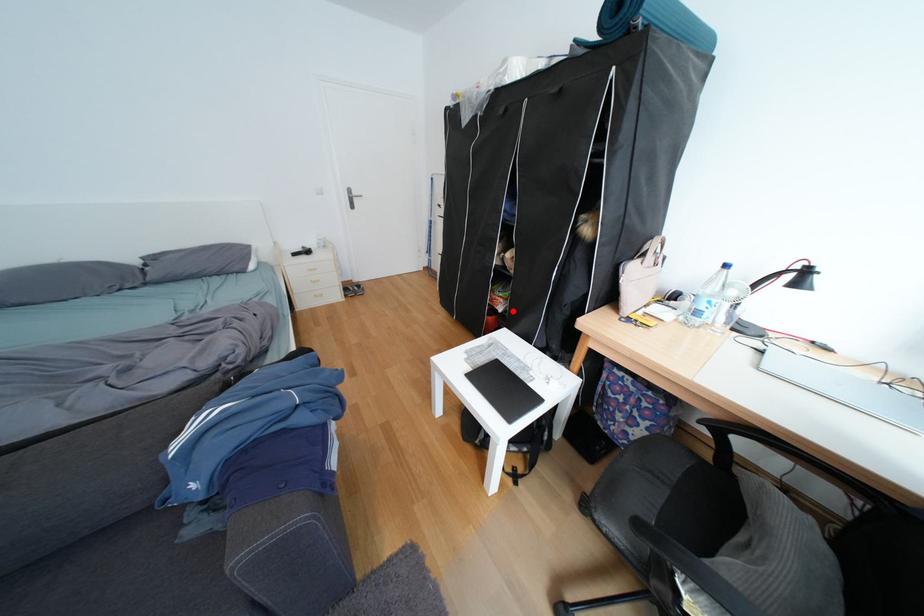
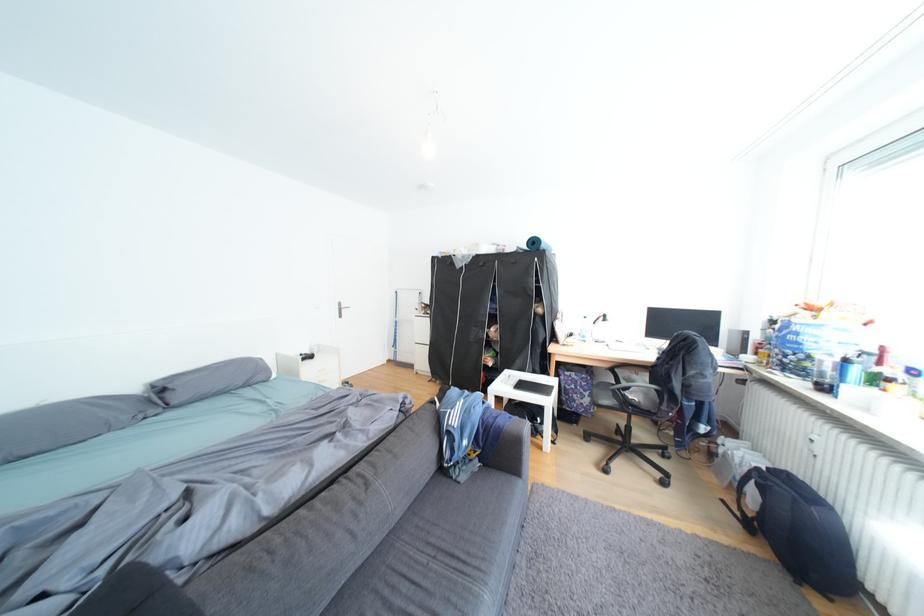
Question: I am providing you with two images of the same scene from different viewpoints. In image1, a red point is highlighted. Considering the same 3D point in image2, which of the following is correct?

Choices:
 (A) It is closer
 (B) It is farther

Answer: (B)